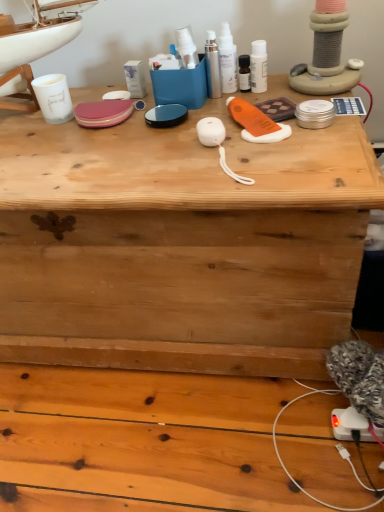
This screenshot has height=512, width=384. Find the location of `vacant area located to the right-hand side of sleek silver spray at center, arranged as the third toiletry when viewed from the right`. vacant area located to the right-hand side of sleek silver spray at center, arranged as the third toiletry when viewed from the right is located at coordinates (285, 91).